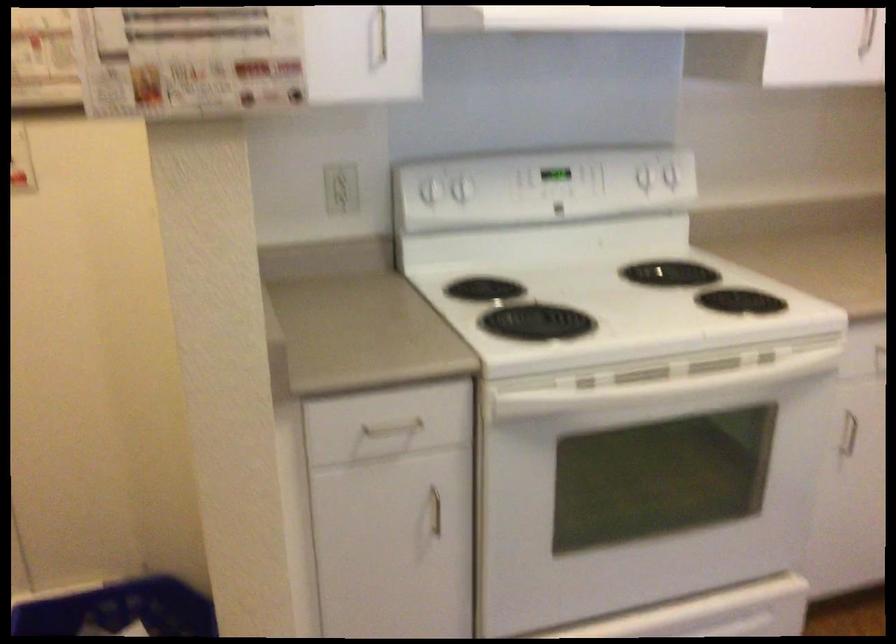
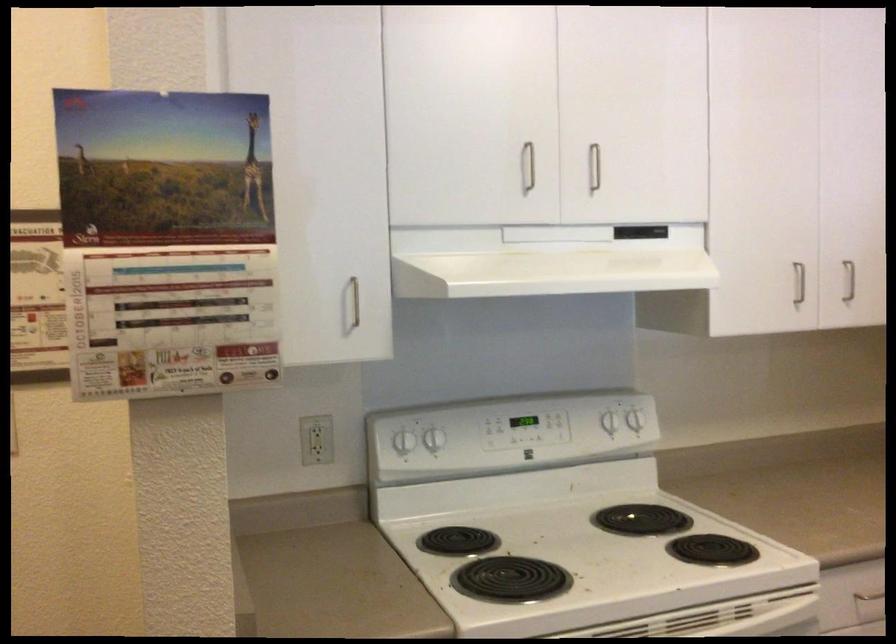
In the second image, find the point that corresponds to (464,185) in the first image.

(435, 439)